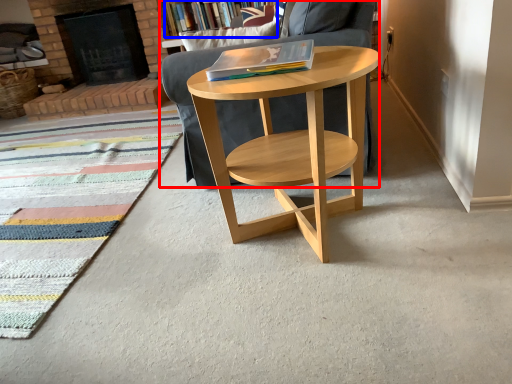
Question: Which object appears farthest to the camera in this image, chair (highlighted by a red box) or bookcase (highlighted by a blue box)?

Choices:
 (A) chair
 (B) bookcase

Answer: (B)